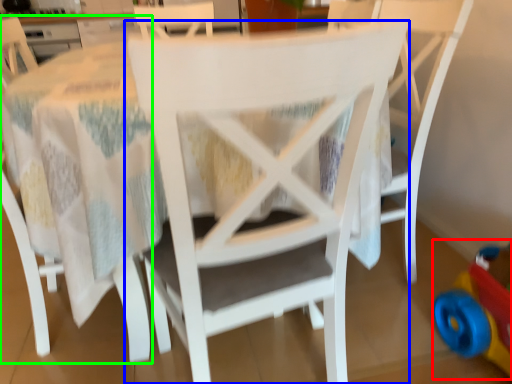
Question: Considering the real-world distances, which object is farthest from toy (highlighted by a red box)? chair (highlighted by a blue box) or chair (highlighted by a green box)?

Choices:
 (A) chair
 (B) chair

Answer: (B)